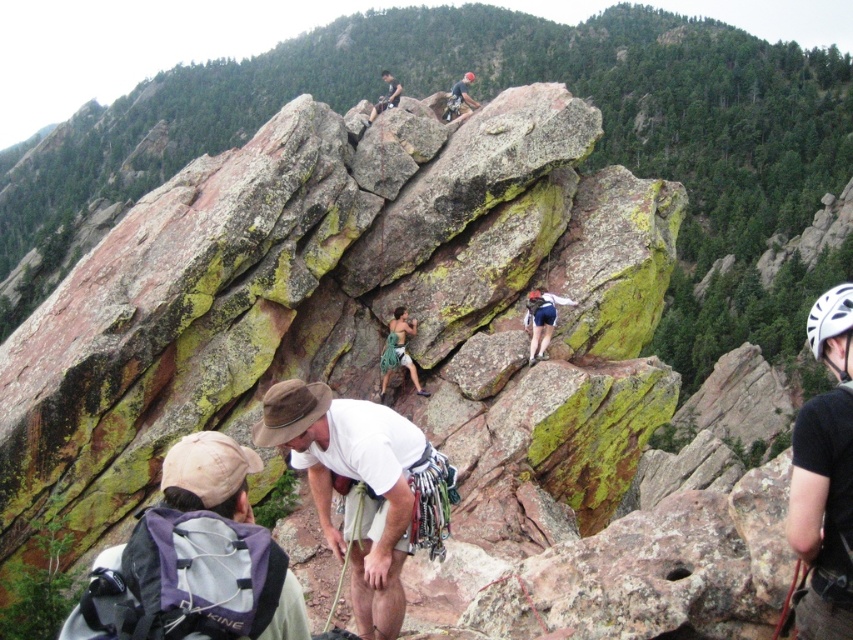
Between gray fabric backpack at lower left and white cotton shirt at center, which one is positioned higher?

Positioned higher is white cotton shirt at center.

Where is `gray fabric backpack at lower left`? gray fabric backpack at lower left is located at coordinates (207, 547).

Who is more distant from viewer, (x=287, y=577) or (x=374, y=403)?

The point (x=374, y=403) is more distant.

Identify the location of gray fabric backpack at lower left. (207, 547).

In the scene shown: Who is shorter, white cotton shirt at center or matte black helmet at upper center?

white cotton shirt at center is shorter.

Which is more to the left, white cotton shirt at center or matte black helmet at upper center?

From the viewer's perspective, white cotton shirt at center appears more on the left side.

You are a GUI agent. You are given a task and a screenshot of the screen. Output one action in this format:
    pyautogui.click(x=<x>, y=<y>)
    Task: Click on the white cotton shirt at center
    This screenshot has width=853, height=640.
    Given the screenshot: What is the action you would take?
    pyautogui.click(x=355, y=484)

Can you confirm if black mesh helmet at upper right is positioned to the right of white matte helmet at upper right?

Incorrect, black mesh helmet at upper right is not on the right side of white matte helmet at upper right.

Does point (802, 499) lie behind point (824, 314)?

No, (802, 499) is closer to viewer.

Locate an element on the screen. This screenshot has width=853, height=640. black mesh helmet at upper right is located at coordinates (822, 513).